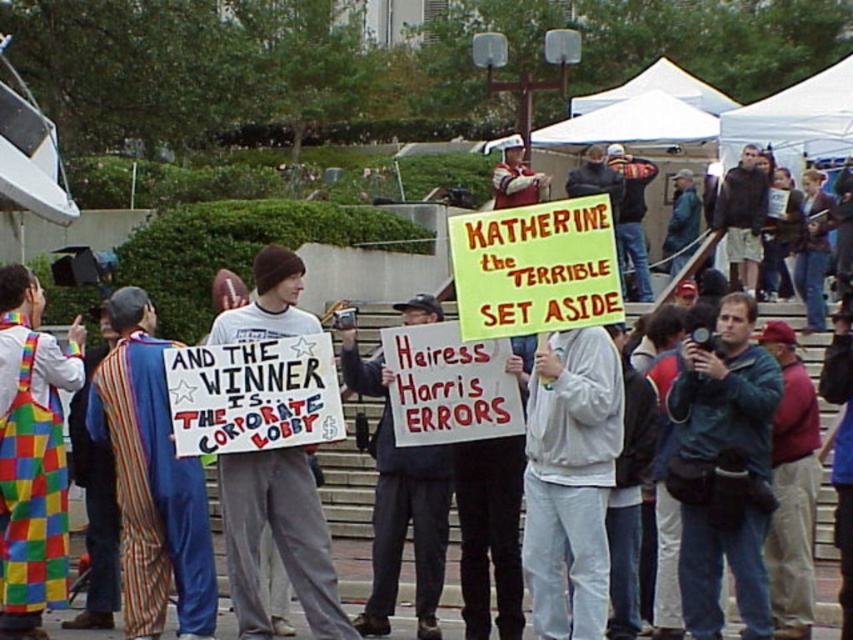
You are a photographer at the protest and want to capture both the striped fabric cape at left and the white paper sign at center in a single frame. Which object should be placed to the left in the photo?

The striped fabric cape at left is positioned on the left side of the white paper sign at center, so it should be placed to the left in the photo.